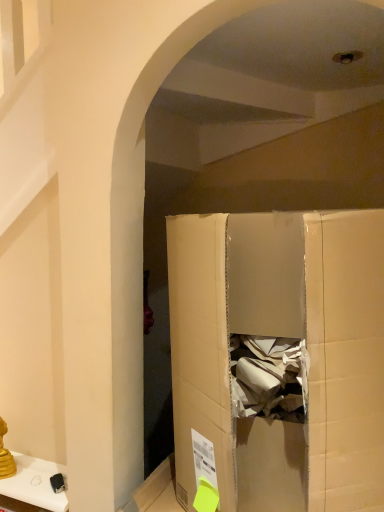
Question: From their relative heights in the image, would you say cardboard box at center is taller or shorter than metallic gold candlestick at lower left?

Choices:
 (A) tall
 (B) short

Answer: (A)

Question: Relative to metallic gold candlestick at lower left, is cardboard box at center in front or behind?

Choices:
 (A) behind
 (B) front

Answer: (B)

Question: Is cardboard box at center wider or thinner than metallic gold candlestick at lower left?

Choices:
 (A) wide
 (B) thin

Answer: (A)

Question: Looking at the image, does metallic gold candlestick at lower left seem bigger or smaller compared to cardboard box at center?

Choices:
 (A) small
 (B) big

Answer: (A)

Question: From the image's perspective, relative to cardboard box at center, is metallic gold candlestick at lower left above or below?

Choices:
 (A) below
 (B) above

Answer: (A)

Question: From a real-world perspective, is metallic gold candlestick at lower left above or below cardboard box at center?

Choices:
 (A) below
 (B) above

Answer: (A)

Question: Is metallic gold candlestick at lower left inside or outside of cardboard box at center?

Choices:
 (A) inside
 (B) outside

Answer: (B)